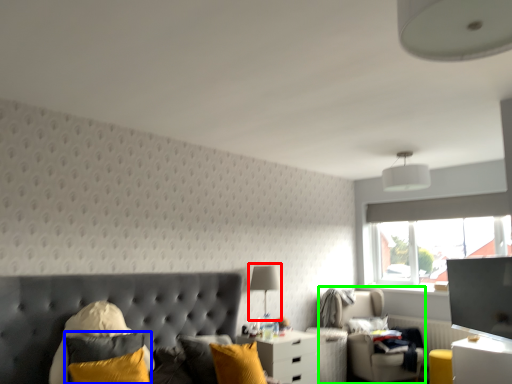
Question: Which object is the farthest from table lamp (highlighted by a red box)? Choose among these: pillow (highlighted by a blue box) or swivel chair (highlighted by a green box).

Choices:
 (A) pillow
 (B) swivel chair

Answer: (A)